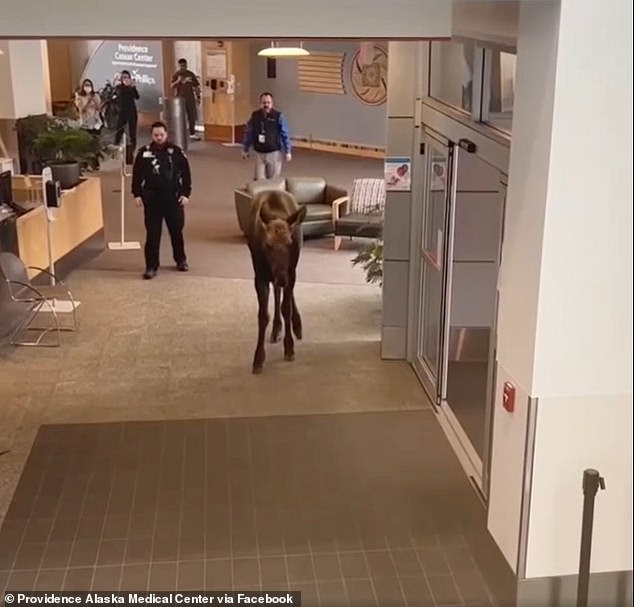
Identify the location of green couch. This screenshot has width=634, height=607. (309, 194).